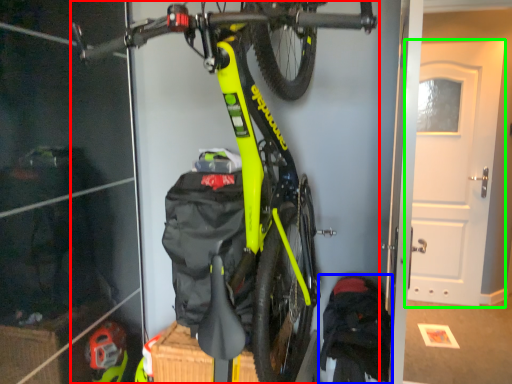
Question: Based on their relative distances, which object is nearer to bicycle (highlighted by a red box)? Choose from backpack (highlighted by a blue box) and door (highlighted by a green box).

Choices:
 (A) backpack
 (B) door

Answer: (A)